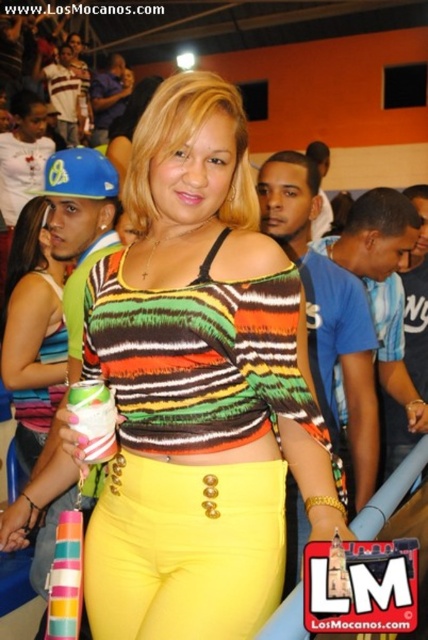
In the scene shown: Can you confirm if matte striped top at center is shorter than yellow matte pants at center?

Incorrect, matte striped top at center's height does not fall short of yellow matte pants at center's.

The height and width of the screenshot is (640, 428). Describe the element at coordinates (199, 387) in the screenshot. I see `matte striped top at center` at that location.

Is point (146, 621) closer to camera compared to point (155, 577)?

Yes, it is in front of point (155, 577).

The width and height of the screenshot is (428, 640). In order to click on matte striped top at center in this screenshot , I will do `click(199, 387)`.

Is yellow matte pants at center to the left of striped fabric top at center from the viewer's perspective?

In fact, yellow matte pants at center is to the right of striped fabric top at center.

Who is more forward, (137, 608) or (24, 324)?

Point (137, 608)

At what (x,y) coordinates should I click in order to perform the action: click on yellow matte pants at center. Please return your answer as a coordinate pair (x, y). The width and height of the screenshot is (428, 640). Looking at the image, I should click on (184, 548).

Is matte striped top at center to the left of striped fabric top at center from the viewer's perspective?

In fact, matte striped top at center is to the right of striped fabric top at center.

The height and width of the screenshot is (640, 428). Describe the element at coordinates (199, 387) in the screenshot. I see `matte striped top at center` at that location.

Image resolution: width=428 pixels, height=640 pixels. In order to click on matte striped top at center in this screenshot , I will do `click(199, 387)`.